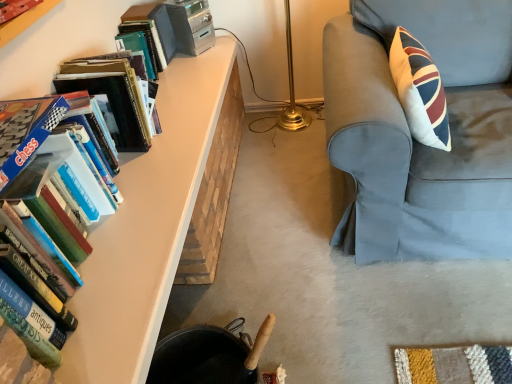
The width and height of the screenshot is (512, 384). Find the location of `vacant area to the left of light blue fabric chair at right`. vacant area to the left of light blue fabric chair at right is located at coordinates pos(274,234).